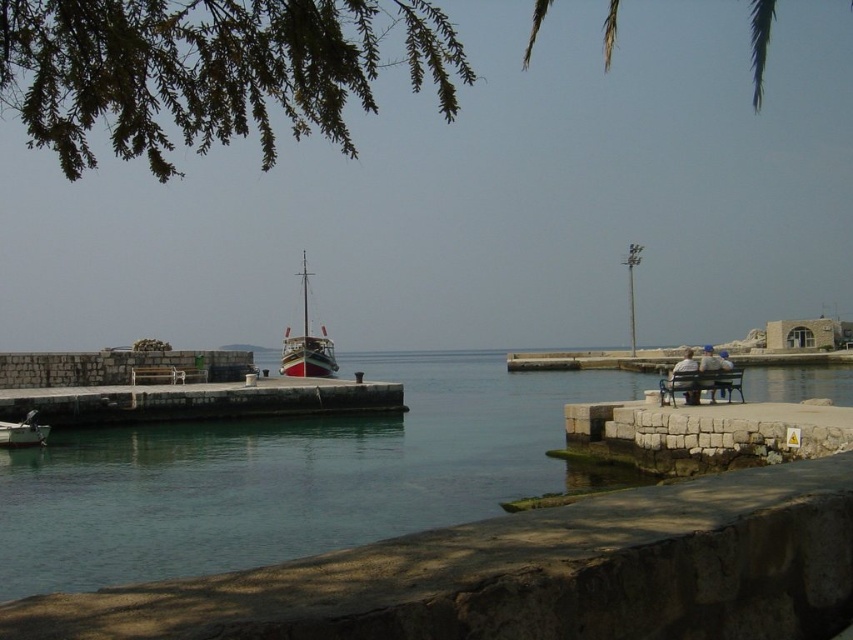
Is green water at center taller than blue denim jeans at lower right?

Yes, green water at center is taller than blue denim jeans at lower right.

The width and height of the screenshot is (853, 640). What do you see at coordinates (292, 476) in the screenshot?
I see `green water at center` at bounding box center [292, 476].

Where is `green water at center`? green water at center is located at coordinates (292, 476).

Is point (737, 374) less distant than point (685, 349)?

Yes.

Which is below, wooden bench at right or light brown wooden bench at right?

light brown wooden bench at right is below.

Is point (729, 376) farther from camera compared to point (683, 358)?

No, it is in front of (683, 358).

Find the location of a particular element. wooden bench at right is located at coordinates (700, 385).

Measure the distance between white wooden boat at left and blue denim jeans at lower right.

white wooden boat at left and blue denim jeans at lower right are 26.32 meters apart.

In the scene shown: Is white wooden boat at left smaller than blue denim jeans at lower right?

Yes.

Locate an element on the screen. Image resolution: width=853 pixels, height=640 pixels. white wooden boat at left is located at coordinates (22, 433).